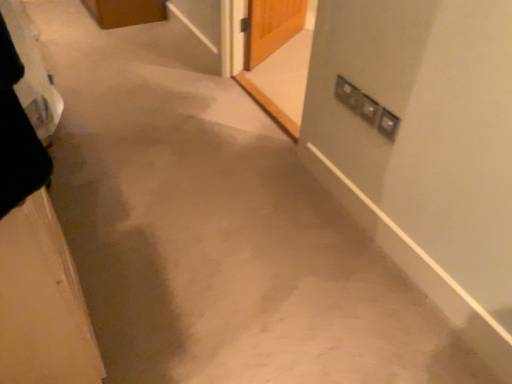
Question: Considering their positions, is matte silver screen door at upper right, marked as the first screen door in a right-to-left arrangement, located in front of or behind transparent glass screen door at upper center, the second screen door in the right-to-left sequence?

Choices:
 (A) front
 (B) behind

Answer: (A)

Question: From their relative heights in the image, would you say matte silver screen door at upper right, the second screen door viewed from the back, is taller or shorter than transparent glass screen door at upper center, the 1th screen door from the back?

Choices:
 (A) tall
 (B) short

Answer: (A)

Question: Based on their relative distances, which object is farther from the wooden door at left?

Choices:
 (A) matte silver screen door at upper right, marked as the first screen door in a right-to-left arrangement
 (B) transparent glass screen door at upper center, the 1th screen door from the back
 (C) satin silver switch at upper right

Answer: (B)

Question: Based on their relative distances, which object is nearer to the satin silver switch at upper right?

Choices:
 (A) transparent glass screen door at upper center, the 1th screen door from the back
 (B) wooden door at left
 (C) matte silver screen door at upper right, the first screen door positioned from the front

Answer: (B)